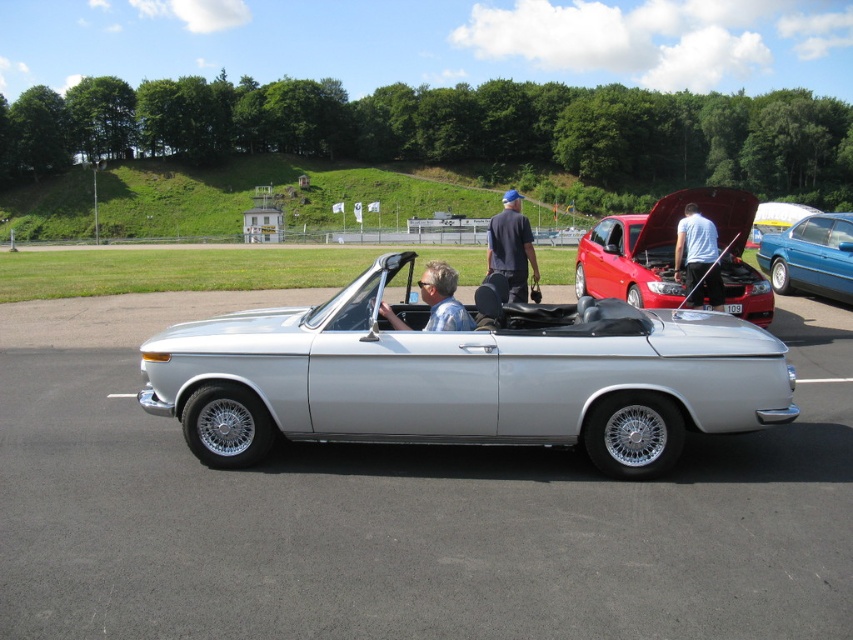
Which is more to the left, shiny red car at center or blue metallic sedan at center?

shiny red car at center

Which is behind, point (766, 324) or point (792, 246)?

The point (792, 246) is more distant.

Identify the location of shiny red car at center. The image size is (853, 640). (672, 253).

Between point (804, 234) and point (717, 241), which one is positioned in front?

Point (717, 241) is in front.

Is blue metallic sedan at center closer to the viewer compared to white cotton shirt at center?

No, it is behind white cotton shirt at center.

Identify the location of blue metallic sedan at center. This screenshot has height=640, width=853. (811, 257).

This screenshot has width=853, height=640. I want to click on blue metallic sedan at center, so click(811, 257).

Is silver metallic convertible at center wider than blue denim jeans at center?

No, silver metallic convertible at center is not wider than blue denim jeans at center.

This screenshot has width=853, height=640. Describe the element at coordinates (465, 378) in the screenshot. I see `silver metallic convertible at center` at that location.

Find the location of a particular element. silver metallic convertible at center is located at coordinates (465, 378).